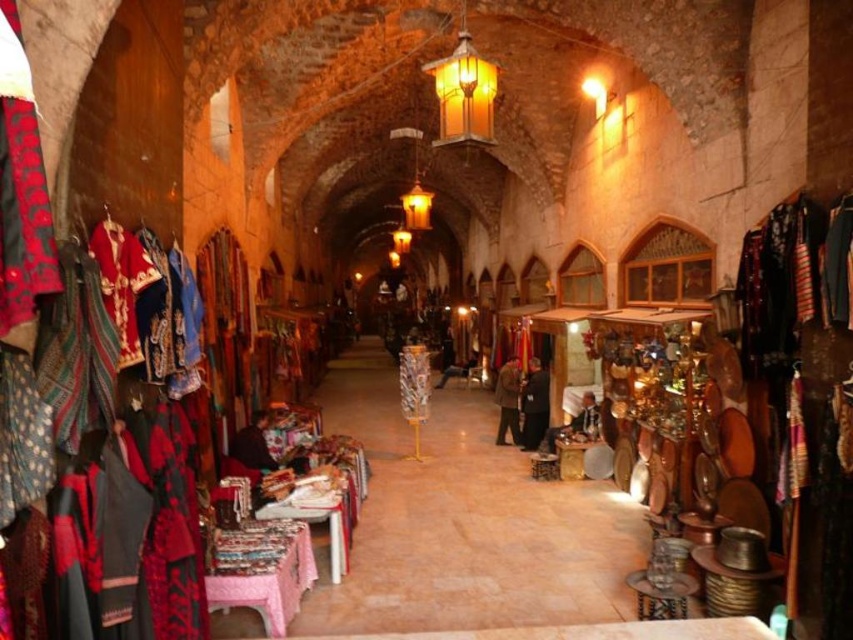
Is black fabric at center positioned before brown wool coat at center?

Yes.

In order to click on black fabric at center in this screenshot , I will do `click(534, 406)`.

Identify the location of black fabric at center. The height and width of the screenshot is (640, 853). (534, 406).